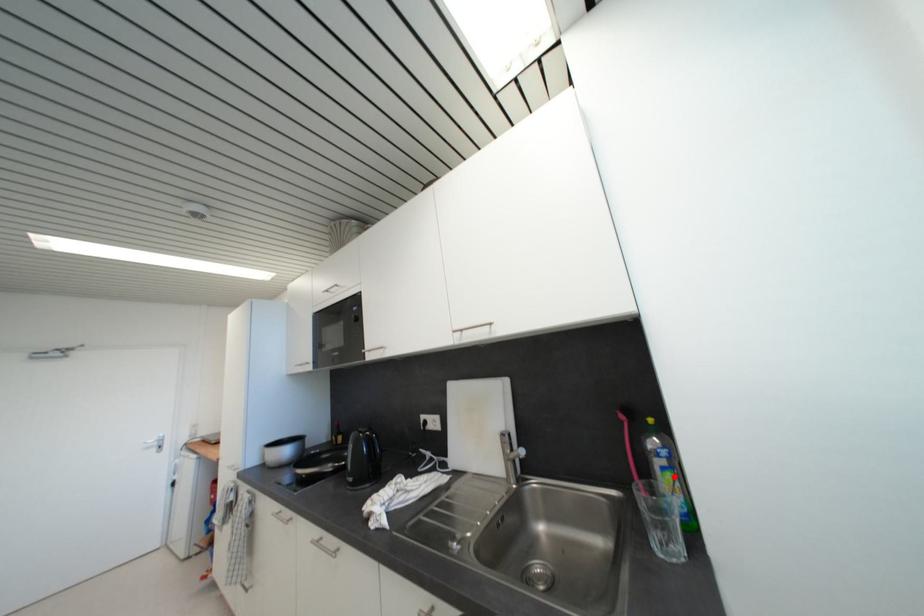
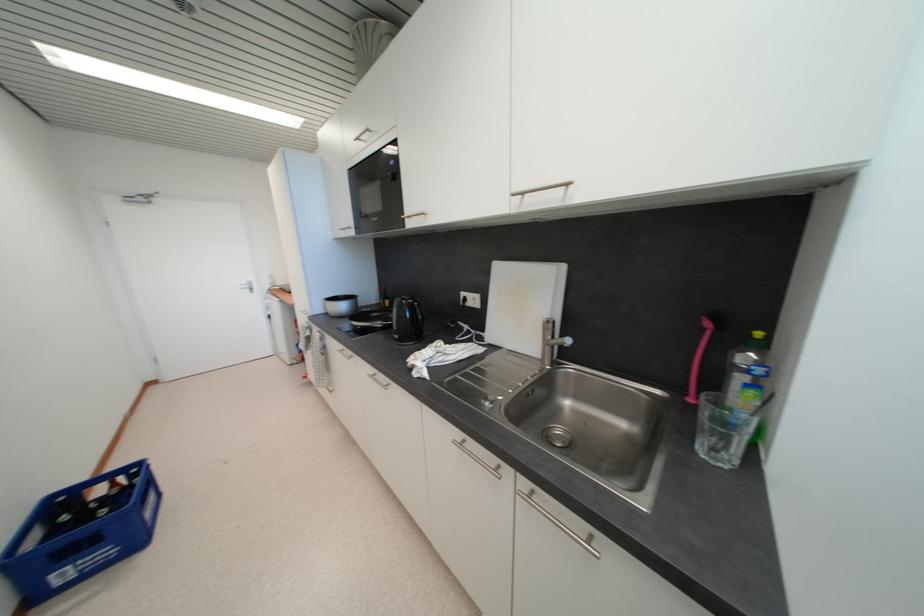
In the second image, find the point that corresponds to the highlighted location in the first image.

(757, 394)